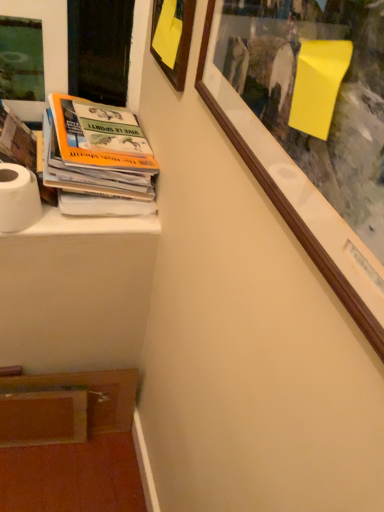
Describe the element at coordinates (18, 198) in the screenshot. I see `white matte toilet paper at lower left` at that location.

The width and height of the screenshot is (384, 512). Find the location of `white matte toilet paper at lower left`. white matte toilet paper at lower left is located at coordinates (18, 198).

Where is `wooden picture frame at upper left, the 1th picture frame in the left-to-right sequence`? The width and height of the screenshot is (384, 512). wooden picture frame at upper left, the 1th picture frame in the left-to-right sequence is located at coordinates (44, 49).

Find the location of a particular element. The width and height of the screenshot is (384, 512). white matte toilet paper at lower left is located at coordinates (18, 198).

This screenshot has height=512, width=384. I want to click on picture frame that appears on the left of wooden picture frame at upper center, which appears as the second picture frame when viewed from the left, so click(44, 49).

From a real-world perspective, which object stands above the other?

From a 3D spatial view, wooden picture frame at upper center, which appears as the second picture frame when viewed from the left, is above.

Is wooden picture frame at upper center, the first picture frame in the right-to-left sequence, oriented towards wooden picture frame at upper left, the 1th picture frame in the left-to-right sequence?

No, wooden picture frame at upper center, the first picture frame in the right-to-left sequence, is not turned towards wooden picture frame at upper left, the 1th picture frame in the left-to-right sequence.

Considering the relative sizes of white paper stack at left and white matte toilet paper at lower left in the image provided, is white paper stack at left shorter than white matte toilet paper at lower left?

Incorrect, the height of white paper stack at left does not fall short of that of white matte toilet paper at lower left.

Find the location of a particular element. The image size is (384, 512). book on the right side of white matte toilet paper at lower left is located at coordinates (92, 164).

Does white paper stack at left have a lesser width compared to white matte toilet paper at lower left?

No, white paper stack at left is not thinner than white matte toilet paper at lower left.

Is white paper stack at left far from white matte toilet paper at lower left?

No.

Can you confirm if wooden picture frame at upper left, placed as the second picture frame when sorted from right to left, is bigger than wooden picture frame at upper center, the first picture frame in the right-to-left sequence?

Yes, wooden picture frame at upper left, placed as the second picture frame when sorted from right to left, is bigger than wooden picture frame at upper center, the first picture frame in the right-to-left sequence.

Consider the image. In the image, is wooden picture frame at upper left, the 1th picture frame in the left-to-right sequence, on the left side or the right side of wooden picture frame at upper center, which appears as the second picture frame when viewed from the left?

From the image, it's evident that wooden picture frame at upper left, the 1th picture frame in the left-to-right sequence, is to the left of wooden picture frame at upper center, which appears as the second picture frame when viewed from the left.

Is wooden picture frame at upper left, placed as the second picture frame when sorted from right to left, far away from wooden picture frame at upper center, the first picture frame in the right-to-left sequence?

No, wooden picture frame at upper left, placed as the second picture frame when sorted from right to left, is not far from wooden picture frame at upper center, the first picture frame in the right-to-left sequence.

Considering the relative positions of wooden picture frame at upper left, placed as the second picture frame when sorted from right to left, and wooden picture frame at upper center, which appears as the second picture frame when viewed from the left, in the image provided, is wooden picture frame at upper left, placed as the second picture frame when sorted from right to left, in front of wooden picture frame at upper center, which appears as the second picture frame when viewed from the left,?

No, wooden picture frame at upper left, placed as the second picture frame when sorted from right to left, is further to the viewer.

From the image's perspective, is wooden picture frame at upper center, the first picture frame in the right-to-left sequence, located beneath white paper stack at left?

Incorrect, from the image's perspective, wooden picture frame at upper center, the first picture frame in the right-to-left sequence, is higher than white paper stack at left.

Consider the image. Which of these two, wooden picture frame at upper center, which appears as the second picture frame when viewed from the left, or white paper stack at left, is thinner?

wooden picture frame at upper center, which appears as the second picture frame when viewed from the left.

Is wooden picture frame at upper center, which appears as the second picture frame when viewed from the left, bigger or smaller than white paper stack at left?

In the image, wooden picture frame at upper center, which appears as the second picture frame when viewed from the left, appears to be smaller than white paper stack at left.

Is point (36, 114) closer to camera compared to point (18, 183)?

No, it is not.

Which object is positioned more to the right, wooden picture frame at upper left, placed as the second picture frame when sorted from right to left, or white matte toilet paper at lower left?

white matte toilet paper at lower left.

Considering the sizes of wooden picture frame at upper left, the 1th picture frame in the left-to-right sequence, and white matte toilet paper at lower left in the image, is wooden picture frame at upper left, the 1th picture frame in the left-to-right sequence, wider or thinner than white matte toilet paper at lower left?

In the image, wooden picture frame at upper left, the 1th picture frame in the left-to-right sequence, appears to be more narrow than white matte toilet paper at lower left.

From a real-world perspective, is wooden picture frame at upper left, the 1th picture frame in the left-to-right sequence, positioned above or below white matte toilet paper at lower left?

From a real-world perspective, wooden picture frame at upper left, the 1th picture frame in the left-to-right sequence, is physically above white matte toilet paper at lower left.

From the image's perspective, relative to wooden picture frame at upper center, the first picture frame in the right-to-left sequence, is white matte toilet paper at lower left above or below?

white matte toilet paper at lower left is situated lower than wooden picture frame at upper center, the first picture frame in the right-to-left sequence, in the image.

Do you think white matte toilet paper at lower left is within wooden picture frame at upper center, the first picture frame in the right-to-left sequence, or outside of it?

white matte toilet paper at lower left exists outside the volume of wooden picture frame at upper center, the first picture frame in the right-to-left sequence.

Is white matte toilet paper at lower left at the right side of wooden picture frame at upper center, which appears as the second picture frame when viewed from the left?

In fact, white matte toilet paper at lower left is to the left of wooden picture frame at upper center, which appears as the second picture frame when viewed from the left.

Considering the positions of objects white matte toilet paper at lower left and wooden picture frame at upper center, the first picture frame in the right-to-left sequence, in the image provided, who is behind, white matte toilet paper at lower left or wooden picture frame at upper center, the first picture frame in the right-to-left sequence,?

white matte toilet paper at lower left is behind.

From the image's perspective, which is above, white paper stack at left or wooden picture frame at upper center, the first picture frame in the right-to-left sequence?

From the image's view, wooden picture frame at upper center, the first picture frame in the right-to-left sequence, is above.

Considering the sizes of objects white paper stack at left and wooden picture frame at upper center, which appears as the second picture frame when viewed from the left, in the image provided, who is wider, white paper stack at left or wooden picture frame at upper center, which appears as the second picture frame when viewed from the left,?

With larger width is white paper stack at left.

Looking at this image, can you confirm if white paper stack at left is positioned to the left of wooden picture frame at upper center, which appears as the second picture frame when viewed from the left?

→ Indeed, white paper stack at left is positioned on the left side of wooden picture frame at upper center, which appears as the second picture frame when viewed from the left.

Is white paper stack at left far from wooden picture frame at upper center, which appears as the second picture frame when viewed from the left?

white paper stack at left is actually quite close to wooden picture frame at upper center, which appears as the second picture frame when viewed from the left.

Locate an element on the screen. The height and width of the screenshot is (512, 384). picture frame above the wooden picture frame at upper left, the 1th picture frame in the left-to-right sequence (from a real-world perspective) is located at coordinates (177, 42).

In the image, there is a white matte toilet paper at lower left. Identify the location of book above it (from the image's perspective). (92, 164).

Based on their spatial positions, is wooden picture frame at upper left, placed as the second picture frame when sorted from right to left, or white matte toilet paper at lower left further from white paper stack at left?

wooden picture frame at upper left, placed as the second picture frame when sorted from right to left, is positioned further to the anchor white paper stack at left.

From the image, which object appears to be nearer to wooden picture frame at upper center, which appears as the second picture frame when viewed from the left, white paper stack at left or white matte toilet paper at lower left?

white paper stack at left is closer to wooden picture frame at upper center, which appears as the second picture frame when viewed from the left.

Looking at the image, which one is located closer to white matte toilet paper at lower left, white paper stack at left or wooden picture frame at upper left, placed as the second picture frame when sorted from right to left?

Based on the image, white paper stack at left appears to be nearer to white matte toilet paper at lower left.

Which object lies nearer to the anchor point wooden picture frame at upper left, the 1th picture frame in the left-to-right sequence, white paper stack at left or wooden picture frame at upper center, which appears as the second picture frame when viewed from the left?

Based on the image, white paper stack at left appears to be nearer to wooden picture frame at upper left, the 1th picture frame in the left-to-right sequence.

In the scene shown: Estimate the real-world distances between objects in this image. Which object is closer to wooden picture frame at upper center, the first picture frame in the right-to-left sequence, white matte toilet paper at lower left or white paper stack at left?

white paper stack at left is closer to wooden picture frame at upper center, the first picture frame in the right-to-left sequence.

Based on the photo, looking at the image, which one is located closer to white matte toilet paper at lower left, wooden picture frame at upper center, which appears as the second picture frame when viewed from the left, or white paper stack at left?

white paper stack at left lies closer to white matte toilet paper at lower left than the other object.

Considering their positions, is wooden picture frame at upper left, placed as the second picture frame when sorted from right to left, positioned further to wooden picture frame at upper center, which appears as the second picture frame when viewed from the left, than white matte toilet paper at lower left?

white matte toilet paper at lower left is further to wooden picture frame at upper center, which appears as the second picture frame when viewed from the left.

When comparing their distances from white matte toilet paper at lower left, does wooden picture frame at upper left, the 1th picture frame in the left-to-right sequence, or white paper stack at left seem closer?

Based on the image, white paper stack at left appears to be nearer to white matte toilet paper at lower left.

At what (x,y) coordinates should I click in order to perform the action: click on book between wooden picture frame at upper left, placed as the second picture frame when sorted from right to left, and white matte toilet paper at lower left in the up-down direction. Please return your answer as a coordinate pair (x, y). The height and width of the screenshot is (512, 384). Looking at the image, I should click on (92, 164).

This screenshot has height=512, width=384. I want to click on book located between wooden picture frame at upper left, placed as the second picture frame when sorted from right to left, and wooden picture frame at upper center, the first picture frame in the right-to-left sequence, in the left-right direction, so click(92, 164).

This screenshot has width=384, height=512. I want to click on toilet paper located between wooden picture frame at upper left, placed as the second picture frame when sorted from right to left, and wooden picture frame at upper center, the first picture frame in the right-to-left sequence, in the left-right direction, so click(x=18, y=198).

Identify the location of book between wooden picture frame at upper center, which appears as the second picture frame when viewed from the left, and white matte toilet paper at lower left vertically. The height and width of the screenshot is (512, 384). (92, 164).